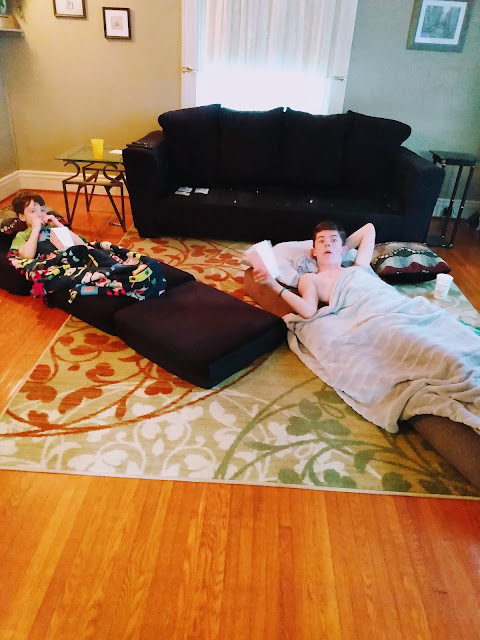
Locate an element on the screen. couch cushions is located at coordinates (200, 125), (237, 134), (327, 141), (361, 143), (186, 326), (115, 308), (17, 284).